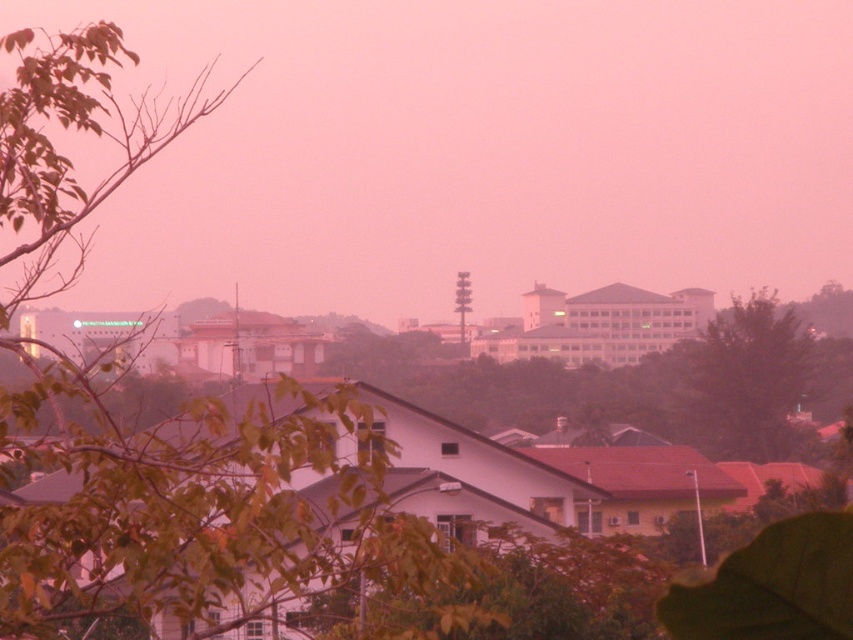
You are standing in the suburban area depicted in the image and want to move from point A to point B. Point A is located at coordinates point (199, 582) and point B is at point (764, 349). Given the haze in the scene, which direction should you head to reach point B from point A?

Since point (199, 582) is closer to the viewer than point (764, 349), you should move away from the foreground towards the background to reach point B from point A.

You are standing in the suburban area depicted in the image. There is a point marked at coordinates (195, 509). What object does this point correspond to?

The point at (195, 509) corresponds to the green leafy tree at upper left.